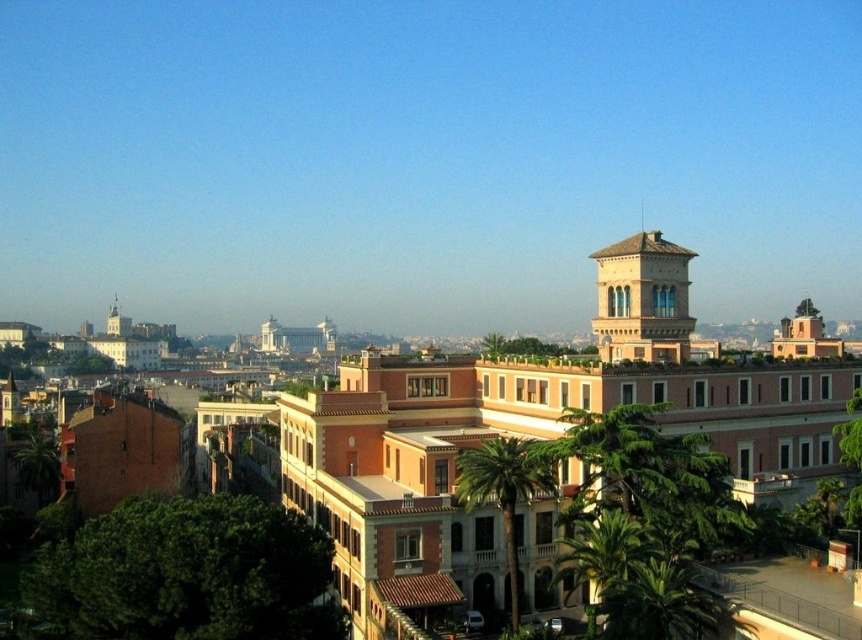
Between green leafy palm tree at center and green leafy palm tree at lower right, which one is positioned lower?

Positioned lower is green leafy palm tree at lower right.

Measure the distance between point [511,573] and camera.

Point [511,573] is 67.18 meters away from camera.

Does point (516, 624) come behind point (592, 536)?

Yes, point (516, 624) is behind point (592, 536).

Find the location of a particular element. The height and width of the screenshot is (640, 862). green leafy palm tree at center is located at coordinates (504, 492).

Can you confirm if beige stone bell tower at upper right is positioned below green leafy palm tree at center?

Actually, beige stone bell tower at upper right is above green leafy palm tree at center.

Can you confirm if beige stone bell tower at upper right is positioned to the left of green leafy palm tree at center?

No, beige stone bell tower at upper right is not to the left of green leafy palm tree at center.

The image size is (862, 640). What do you see at coordinates (642, 300) in the screenshot?
I see `beige stone bell tower at upper right` at bounding box center [642, 300].

The image size is (862, 640). In order to click on beige stone bell tower at upper right in this screenshot , I will do `click(642, 300)`.

Does beige stone bell tower at upper right have a smaller size compared to green leafy palm tree at lower right?

No, beige stone bell tower at upper right is not smaller than green leafy palm tree at lower right.

Does beige stone bell tower at upper right have a greater height compared to green leafy palm tree at lower right?

Yes, beige stone bell tower at upper right is taller than green leafy palm tree at lower right.

Measure the distance between beige stone bell tower at upper right and camera.

78.50 meters

Identify the location of beige stone bell tower at upper right. This screenshot has height=640, width=862. (642, 300).